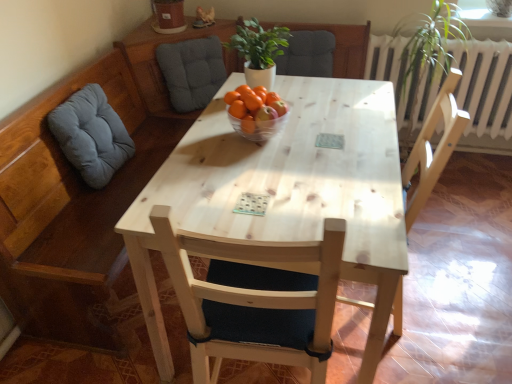
Find the location of a particular element. free space above transparent glass bowl at center (from a real-world perspective) is located at coordinates (262, 114).